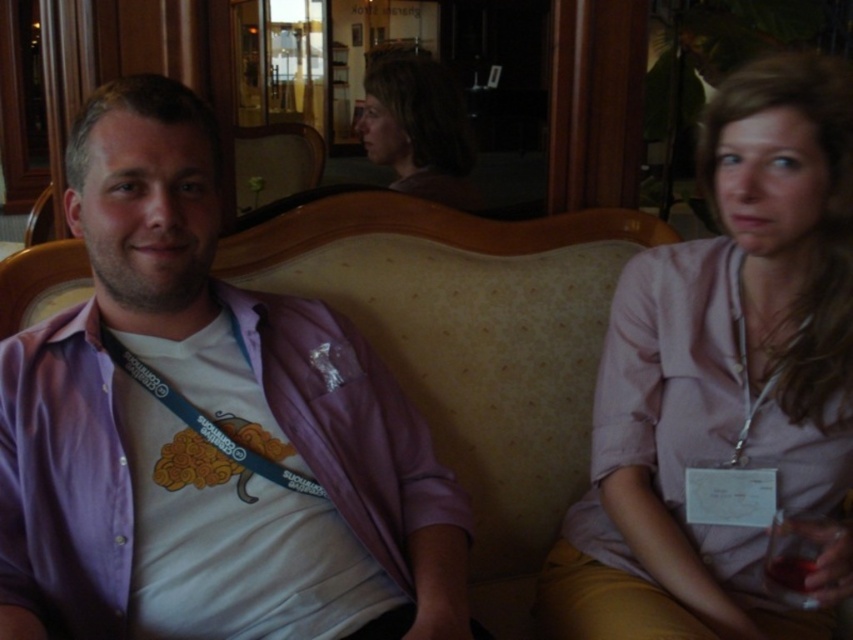
Is purple cotton shirt at left to the right of pink fabric shirt at center from the viewer's perspective?

No, purple cotton shirt at left is not to the right of pink fabric shirt at center.

Which is behind, point (112, 632) or point (821, 420)?

Point (821, 420)

Measure the distance between purple cotton shirt at left and camera.

purple cotton shirt at left is 33.60 inches away from camera.

Find the location of a particular element. Image resolution: width=853 pixels, height=640 pixels. purple cotton shirt at left is located at coordinates (199, 435).

Can you confirm if beige fabric couch at center is positioned below matte brown hair at center?

Indeed, beige fabric couch at center is positioned under matte brown hair at center.

Between point (544, 442) and point (422, 80), which one is positioned in front?

Point (544, 442)

Locate an element on the screen. beige fabric couch at center is located at coordinates [x=469, y=346].

Is pink fabric shirt at center thinner than matte brown hair at center?

In fact, pink fabric shirt at center might be wider than matte brown hair at center.

Can you confirm if pink fabric shirt at center is positioned to the left of matte brown hair at center?

In fact, pink fabric shirt at center is to the right of matte brown hair at center.

Which is in front, point (766, 378) or point (415, 147)?

Point (766, 378) is in front.

Identify the location of pink fabric shirt at center. The image size is (853, 640). tap(723, 376).